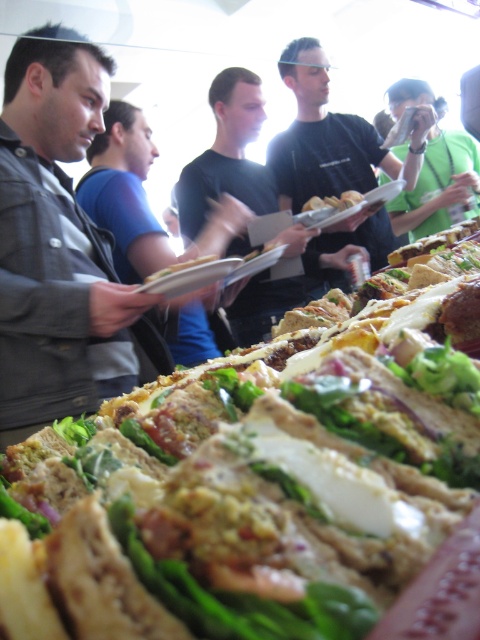
Question: Is black matte shirt at center to the left of green fabric shirt at upper right from the viewer's perspective?

Choices:
 (A) yes
 (B) no

Answer: (A)

Question: Does black shirt at center come in front of white bread at center?

Choices:
 (A) yes
 (B) no

Answer: (A)

Question: Which of the following is the farthest from the observer?

Choices:
 (A) green leafy salad at center
 (B) green leafy lettuce at center

Answer: (B)

Question: Which of the following is the farthest from the observer?

Choices:
 (A) black shirt at center
 (B) green leafy salad at center

Answer: (A)

Question: Estimate the real-world distances between objects in this image. Which object is farther from the green fabric shirt at upper right?

Choices:
 (A) black matte shirt at center
 (B) green leafy salad at center

Answer: (B)

Question: Does black matte shirt at center appear on the left side of green fabric shirt at upper right?

Choices:
 (A) no
 (B) yes

Answer: (B)